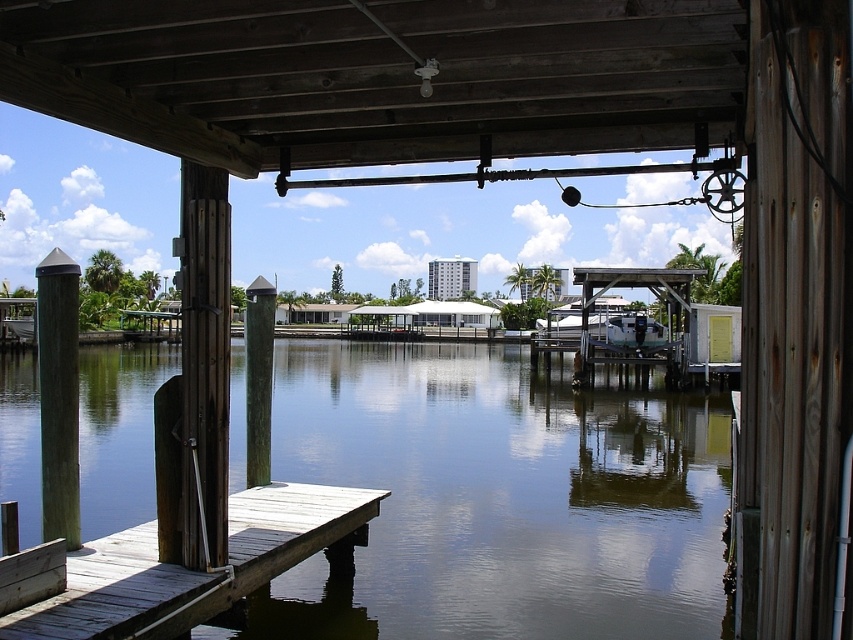
You are standing on the wooden walkway and want to know what is located at the coordinates point (497, 499). According to the scene description, what is present at that specific point?

At point (497, 499) lies greenish gray water at center.

You are designing a model of this waterfront scene. You need to ensure the wooden planks at lower left and the brown wood post at center are proportionally accurate. Which object should have a wider representation in your model?

The wooden planks at lower left should be wider in the model since their width is larger than the brown wood post at center according to the description.